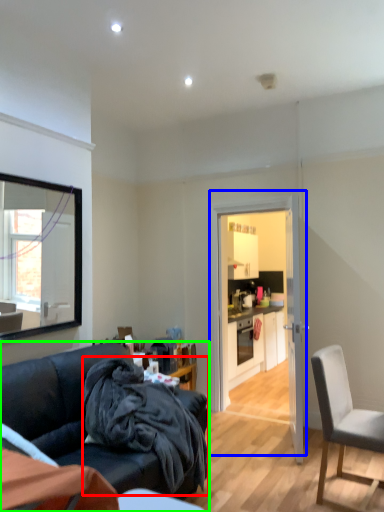
Question: Based on their relative distances, which object is farther from blanket (highlighted by a red box)? Choose from door (highlighted by a blue box) and studio couch (highlighted by a green box).

Choices:
 (A) door
 (B) studio couch

Answer: (A)